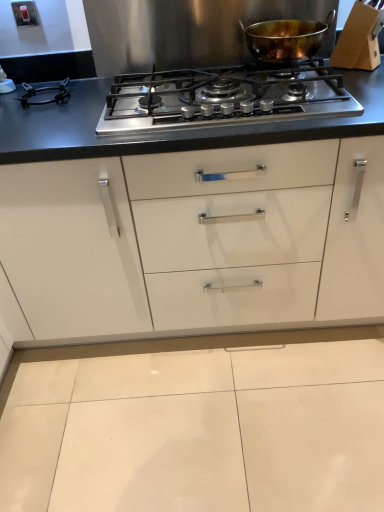
Question: Does shiny copper pot at upper center contain stainless steel gas stove at center?

Choices:
 (A) yes
 (B) no

Answer: (B)

Question: Does shiny copper pot at upper center have a greater height compared to stainless steel gas stove at center?

Choices:
 (A) yes
 (B) no

Answer: (A)

Question: Are shiny copper pot at upper center and stainless steel gas stove at center far apart?

Choices:
 (A) yes
 (B) no

Answer: (B)

Question: Is shiny copper pot at upper center next to stainless steel gas stove at center and touching it?

Choices:
 (A) no
 (B) yes

Answer: (A)

Question: Is shiny copper pot at upper center oriented towards stainless steel gas stove at center?

Choices:
 (A) yes
 (B) no

Answer: (B)

Question: Does shiny copper pot at upper center have a greater width compared to stainless steel gas stove at center?

Choices:
 (A) no
 (B) yes

Answer: (A)

Question: Can you confirm if stainless steel gas stove at center is thinner than shiny copper pot at upper center?

Choices:
 (A) yes
 (B) no

Answer: (B)

Question: Can you confirm if stainless steel gas stove at center is smaller than shiny copper pot at upper center?

Choices:
 (A) no
 (B) yes

Answer: (A)

Question: Is stainless steel gas stove at center in front of shiny copper pot at upper center?

Choices:
 (A) no
 (B) yes

Answer: (B)

Question: Can shiny copper pot at upper center be found inside stainless steel gas stove at center?

Choices:
 (A) yes
 (B) no

Answer: (B)

Question: From the image's perspective, is stainless steel gas stove at center under shiny copper pot at upper center?

Choices:
 (A) no
 (B) yes

Answer: (B)

Question: Can we say stainless steel gas stove at center lies outside shiny copper pot at upper center?

Choices:
 (A) no
 (B) yes

Answer: (B)

Question: Is point (185, 140) positioned closer to the camera than point (253, 31)?

Choices:
 (A) closer
 (B) farther

Answer: (A)